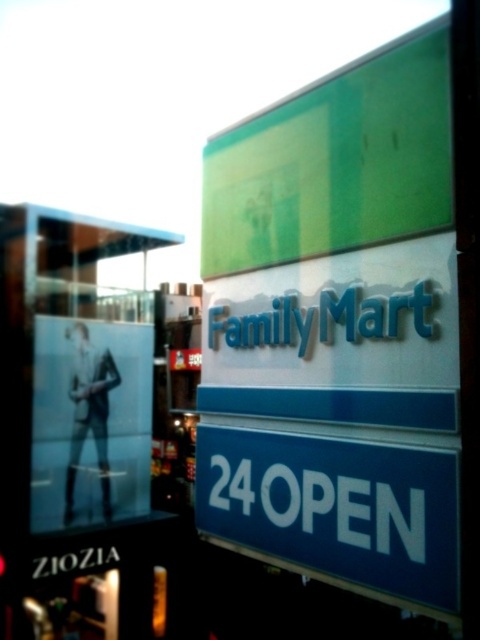
You are standing in front of the FamilyMart store and want to check if the transparent glass window at upper left and the blue glossy sign at center are aligned horizontally. Are they aligned?

The transparent glass window at upper left is to the left of blue glossy sign at center, so they are not aligned horizontally.

Consider the image. You are standing in front of the FamilyMart store and want to check if the transparent glass window at upper left is within your reach to touch. Considering the average human arm length is about 0.7 meters, can you touch it?

The transparent glass window at upper left is 5.63 meters away from viewer, which is much farther than the average human arm length of 0.7 meters. Therefore, you cannot touch it.

You are standing in front of the FamilyMart store. You notice a transparent glass window at upper left and a blue glossy sign at center. Which object is taller?

The transparent glass window at upper left is taller than the blue glossy sign at center.